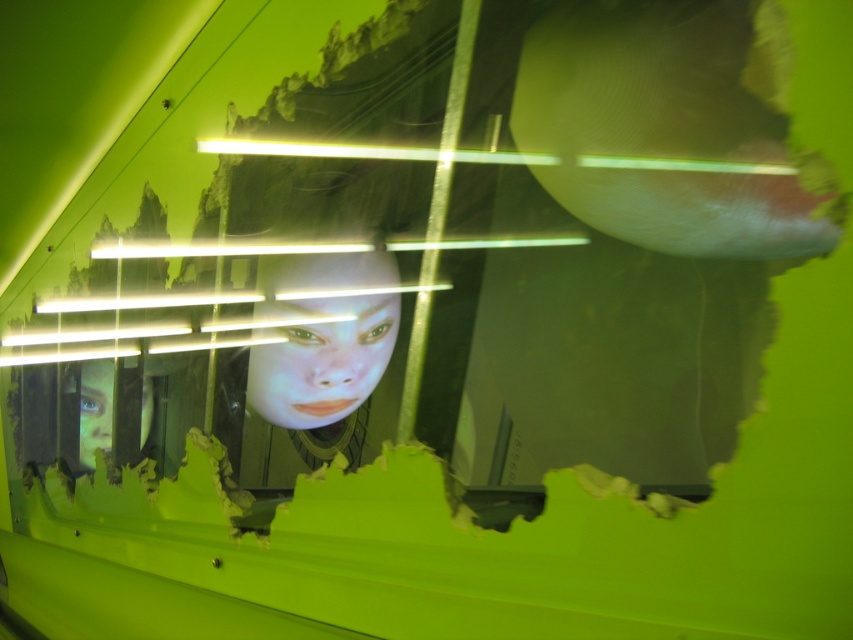
Question: Which of the following is the closest to the observer?

Choices:
 (A) smooth green face at left
 (B) smooth skin face at center

Answer: (B)

Question: From the image, what is the correct spatial relationship of smooth skin face at center in relation to smooth green face at left?

Choices:
 (A) above
 (B) below

Answer: (A)

Question: Is smooth skin face at center above smooth green face at left?

Choices:
 (A) yes
 (B) no

Answer: (A)

Question: Considering the relative positions of smooth skin face at center and smooth green face at left in the image provided, where is smooth skin face at center located with respect to smooth green face at left?

Choices:
 (A) right
 (B) left

Answer: (A)

Question: Which point is closer to the camera taking this photo?

Choices:
 (A) (311, 275)
 (B) (141, 406)

Answer: (A)

Question: Which object appears closest to the camera in this image?

Choices:
 (A) smooth skin face at center
 (B) smooth green face at left

Answer: (A)